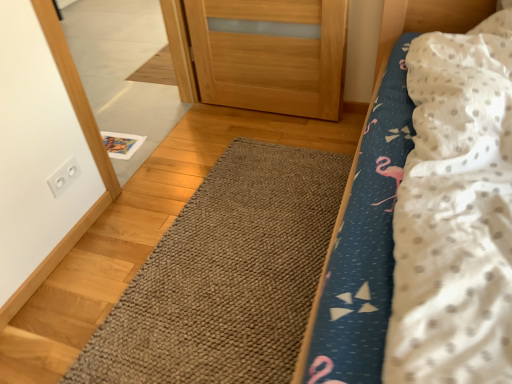
Question: Can you confirm if fluffy fabric bed at center is positioned to the left of white glossy mirror at upper left?

Choices:
 (A) no
 (B) yes

Answer: (A)

Question: Can you confirm if fluffy fabric bed at center is wider than white glossy mirror at upper left?

Choices:
 (A) yes
 (B) no

Answer: (A)

Question: Is fluffy fabric bed at center positioned with its back to white glossy mirror at upper left?

Choices:
 (A) no
 (B) yes

Answer: (A)

Question: From the image's perspective, is fluffy fabric bed at center beneath white glossy mirror at upper left?

Choices:
 (A) yes
 (B) no

Answer: (A)

Question: From the image's perspective, is fluffy fabric bed at center on top of white glossy mirror at upper left?

Choices:
 (A) no
 (B) yes

Answer: (A)

Question: Is fluffy fabric bed at center taller than white glossy mirror at upper left?

Choices:
 (A) yes
 (B) no

Answer: (A)

Question: From the image's perspective, is white plastic outlet at upper left beneath brown textured rug at center?

Choices:
 (A) yes
 (B) no

Answer: (B)

Question: Considering the relative sizes of white plastic outlet at upper left and brown textured rug at center in the image provided, is white plastic outlet at upper left wider than brown textured rug at center?

Choices:
 (A) yes
 (B) no

Answer: (B)

Question: Considering the relative sizes of white plastic outlet at upper left and brown textured rug at center in the image provided, is white plastic outlet at upper left bigger than brown textured rug at center?

Choices:
 (A) no
 (B) yes

Answer: (A)

Question: Is white plastic outlet at upper left looking in the opposite direction of brown textured rug at center?

Choices:
 (A) no
 (B) yes

Answer: (A)

Question: Considering the relative positions of white plastic outlet at upper left and brown textured rug at center in the image provided, is white plastic outlet at upper left to the right of brown textured rug at center from the viewer's perspective?

Choices:
 (A) no
 (B) yes

Answer: (A)

Question: From a real-world perspective, is white plastic outlet at upper left positioned over brown textured rug at center based on gravity?

Choices:
 (A) no
 (B) yes

Answer: (B)

Question: Can you confirm if brown textured rug at center is taller than white glossy mirror at upper left?

Choices:
 (A) no
 (B) yes

Answer: (A)